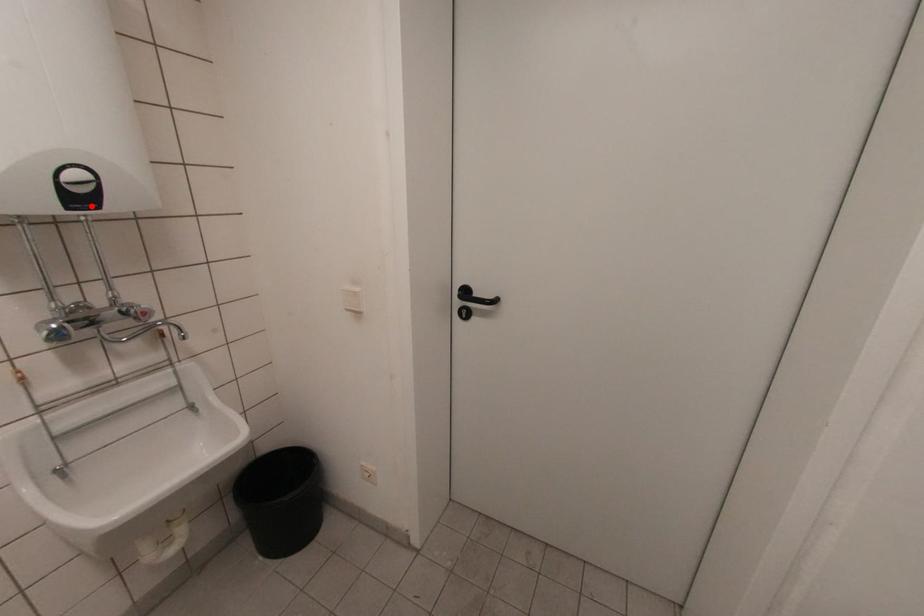
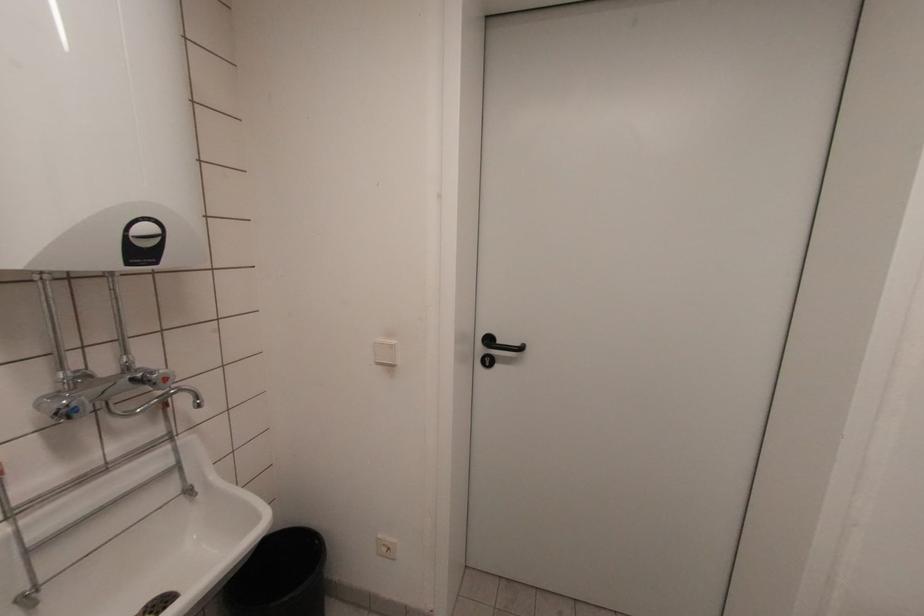
Where in the second image is the point corresponding to the highlighted location from the first image?

(151, 261)